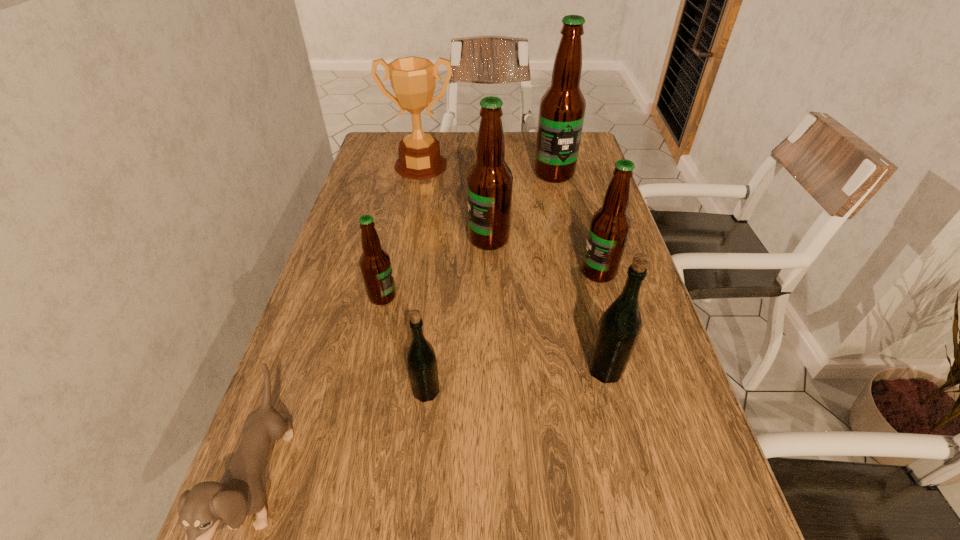
At what (x,y) coordinates should I click in order to perform the action: click on the left green beer bottle. Please return your answer as a coordinate pair (x, y). Looking at the image, I should click on (421, 360).

This screenshot has height=540, width=960. In order to click on the smaller green beer bottle in this screenshot , I will do `click(421, 360)`.

Find the location of a particular element. The image size is (960, 540). free point located 0.290m on the label of the farthest beer bottle is located at coordinates (570, 245).

You are a GUI agent. You are given a task and a screenshot of the screen. Output one action in this format:
    pyautogui.click(x=<x>, y=<y>)
    Task: Click on the vacant space situated 0.210m on the label of the third farthest object
    The height and width of the screenshot is (540, 960).
    Given the screenshot: What is the action you would take?
    pyautogui.click(x=390, y=239)

I want to click on vacant space positioned 0.090m on the label of the third farthest object, so click(x=435, y=239).

At what (x,y) coordinates should I click in order to perform the action: click on vacant point located on the label of the third farthest object. Please return your answer as a coordinate pair (x, y). Looking at the image, I should click on (348, 239).

At what (x,y) coordinates should I click in order to perform the action: click on free point located 0.230m on the front-facing side of the award. Please return your answer as a coordinate pair (x, y). The width and height of the screenshot is (960, 540). Looking at the image, I should click on 410,225.

Locate an element on the screen. free space located 0.160m on the label of the third biggest brown beer bottle is located at coordinates (516, 272).

The image size is (960, 540). In order to click on free location located 0.370m on the label of the third biggest brown beer bottle in this screenshot , I will do `click(430, 272)`.

Locate an element on the screen. Image resolution: width=960 pixels, height=540 pixels. vacant region located 0.370m on the label of the third biggest brown beer bottle is located at coordinates (430, 272).